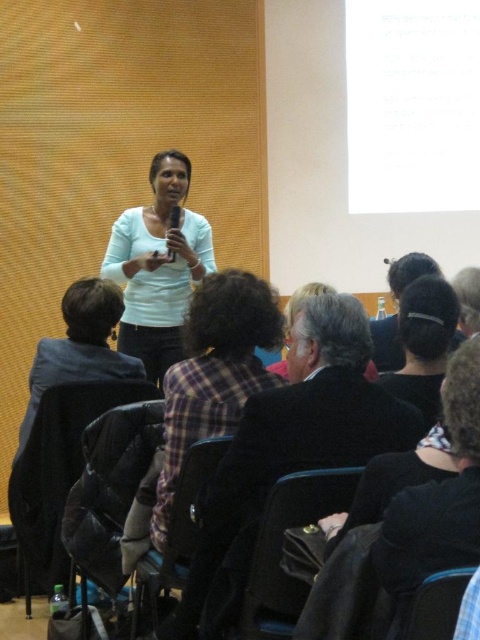
Question: Does matte white shirt at center appear on the right side of dark gray fabric jacket at lower left?

Choices:
 (A) yes
 (B) no

Answer: (A)

Question: Estimate the real-world distances between objects in this image. Which object is closer to the matte white shirt at center?

Choices:
 (A) dark hair at center
 (B) plaid fabric shirt at center

Answer: (B)

Question: Estimate the real-world distances between objects in this image. Which object is closer to the dark brown leather jacket at center?

Choices:
 (A) dark hair at center
 (B) matte white shirt at center

Answer: (A)

Question: Is matte white shirt at center smaller than dark gray fabric jacket at lower left?

Choices:
 (A) yes
 (B) no

Answer: (B)

Question: Can you confirm if plaid fabric shirt at center is positioned to the left of dark gray fabric jacket at lower left?

Choices:
 (A) no
 (B) yes

Answer: (A)

Question: Among these points, which one is farthest from the camera?

Choices:
 (A) (215, 364)
 (B) (423, 312)
 (C) (397, 420)

Answer: (A)